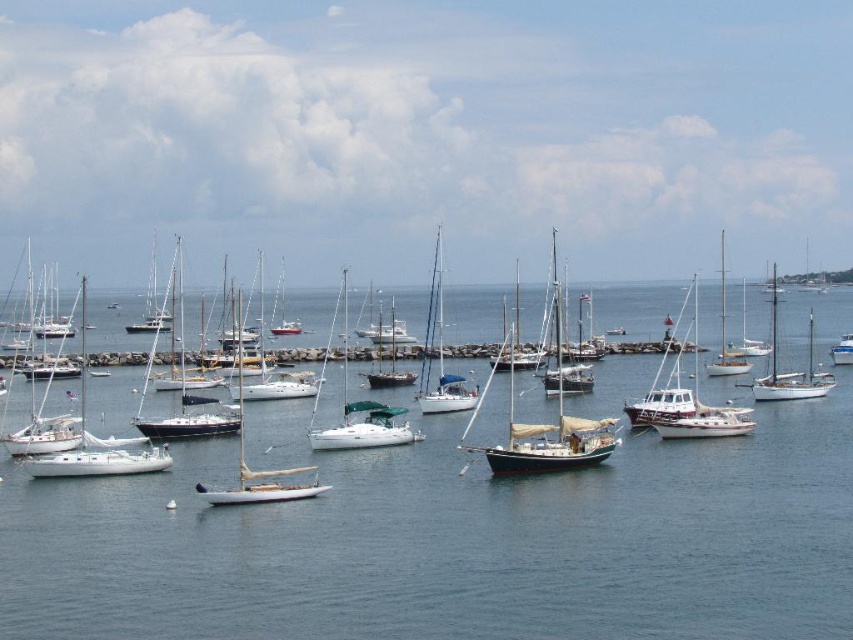
You are a photographer standing at the edge of the marina. You want to take a photo that includes both the blue water at center and the dark brown wooden sailboat at center. Based on their positions, which object will appear closer to the bottom of your photo?

The blue water at center is not as tall as the dark brown wooden sailboat at center, so in the photo, the blue water at center will appear closer to the bottom of the photo.